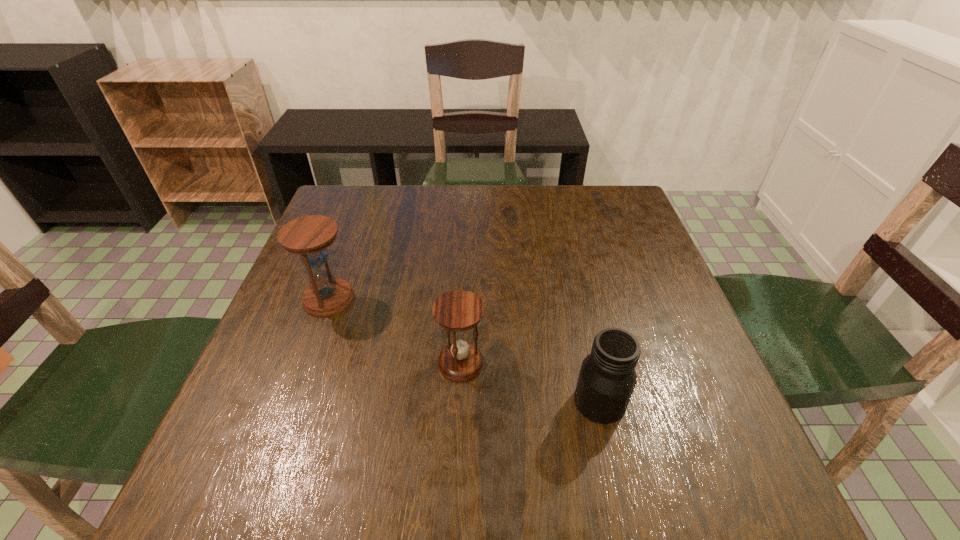
Image resolution: width=960 pixels, height=540 pixels. I want to click on the farther hourglass, so click(309, 236).

Locate an element on the screen. the leftmost object is located at coordinates (309, 236).

This screenshot has height=540, width=960. In order to click on the rightmost object in this screenshot , I will do `click(607, 378)`.

You are a GUI agent. You are given a task and a screenshot of the screen. Output one action in this format:
    pyautogui.click(x=<x>, y=<y>)
    Task: Click on the second object from left to right
    
    Given the screenshot: What is the action you would take?
    pyautogui.click(x=457, y=311)

Image resolution: width=960 pixels, height=540 pixels. I want to click on the right hourglass, so point(457,311).

The height and width of the screenshot is (540, 960). In order to click on free space located 0.100m on the front of the leftmost object in this screenshot , I will do `click(309, 353)`.

Image resolution: width=960 pixels, height=540 pixels. What are the coordinates of `vacant space situated on the back of the rightmost object` in the screenshot? It's located at (572, 282).

Where is `vacant area situated 0.380m on the back of the shorter hourglass`? vacant area situated 0.380m on the back of the shorter hourglass is located at coordinates (466, 235).

You are a GUI agent. You are given a task and a screenshot of the screen. Output one action in this format:
    pyautogui.click(x=<x>, y=<y>)
    Task: Click on the object that is positioned at the left edge
    
    Given the screenshot: What is the action you would take?
    pyautogui.click(x=309, y=236)

Find the location of a particular element. The width and height of the screenshot is (960, 540). vacant space at the far edge of the desktop is located at coordinates (552, 192).